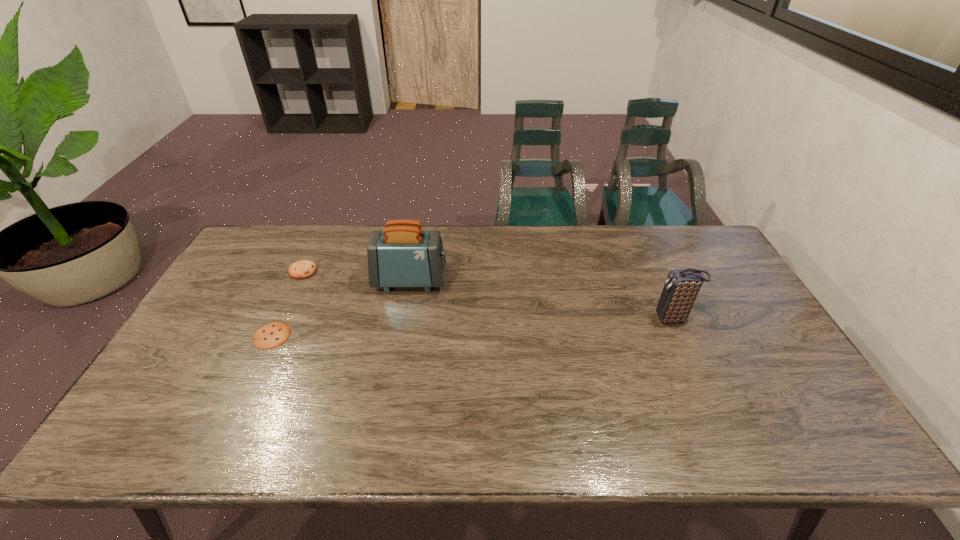
You are a GUI agent. You are given a task and a screenshot of the screen. Output one action in this format:
    pyautogui.click(x=<x>, y=<y>)
    Task: Click on the second closest object to the farther cookie
    
    Given the screenshot: What is the action you would take?
    pyautogui.click(x=402, y=255)

This screenshot has height=540, width=960. What are the coordinates of `the third closest object to the shorter cookie` in the screenshot? It's located at (681, 288).

Identify the location of free space that satisfies the following two spatial constraints: 1. on the back side of the nearer cookie; 2. on the left side of the farther cookie. The height and width of the screenshot is (540, 960). (302, 271).

You are a GUI agent. You are given a task and a screenshot of the screen. Output one action in this format:
    pyautogui.click(x=<x>, y=<y>)
    Task: Click on the vacant area that satisfies the following two spatial constraints: 1. on the back side of the taller cookie; 2. on the left side of the nearer cookie
    This screenshot has height=540, width=960.
    Given the screenshot: What is the action you would take?
    pyautogui.click(x=302, y=271)